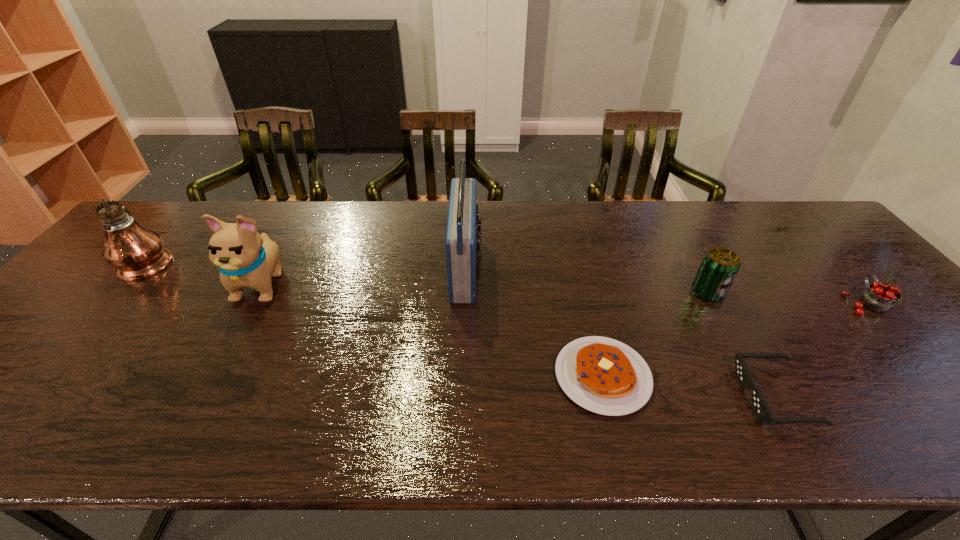
Locate an element on the screen. This screenshot has height=540, width=960. the tallest object is located at coordinates (137, 253).

This screenshot has height=540, width=960. What are the coordinates of `oil lamp` in the screenshot? It's located at (137, 253).

Find the location of a particular element. the third object from left to right is located at coordinates (462, 242).

Find the location of `puppy`. puppy is located at coordinates (246, 259).

Locate an element on the screen. beer can is located at coordinates (719, 267).

The height and width of the screenshot is (540, 960). Find the location of `the rightmost object`. the rightmost object is located at coordinates (878, 297).

Where is `the fifth tallest object`? The image size is (960, 540). the fifth tallest object is located at coordinates (878, 297).

Find the location of a particular element. The width and height of the screenshot is (960, 540). pancake is located at coordinates (603, 375).

Find the location of a particular element. sunglasses is located at coordinates (759, 404).

You are a GUI agent. You are given a task and a screenshot of the screen. Output one action in this format:
    pyautogui.click(x=<x>, y=<y>)
    Task: Click on the free location located 0.250m on the right of the tallest object
    
    Given the screenshot: What is the action you would take?
    pyautogui.click(x=260, y=261)